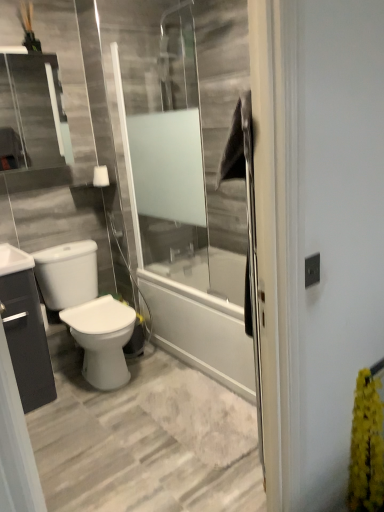
Find the location of a particular element. Image resolution: width=384 pixels, height=512 pixels. free space in front of matte black cabinet at left is located at coordinates (42, 417).